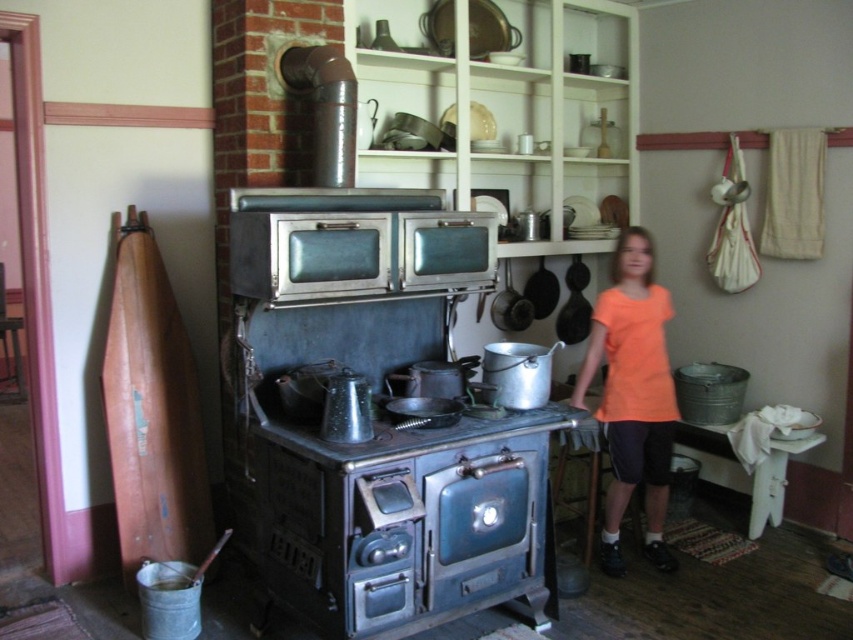
Which of these two, orange t-shirt at right or blue cast iron stove at center, stands taller?

With more height is orange t-shirt at right.

Between point (634, 282) and point (282, 422), which one is positioned in front?

Positioned in front is point (282, 422).

You are a GUI agent. You are given a task and a screenshot of the screen. Output one action in this format:
    pyautogui.click(x=<x>, y=<y>)
    Task: Click on the orange t-shirt at right
    
    Given the screenshot: What is the action you would take?
    pyautogui.click(x=633, y=394)